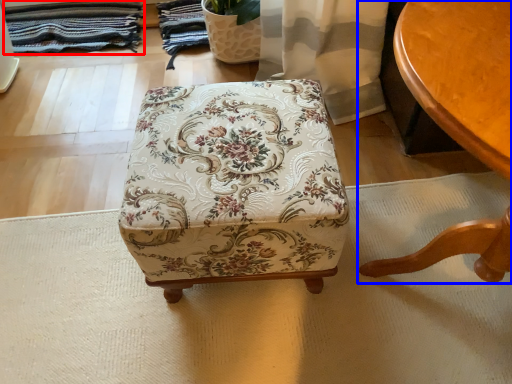
Question: Which of the following is the closest to the observer, blanket (highlighted by a red box) or table (highlighted by a blue box)?

Choices:
 (A) blanket
 (B) table

Answer: (B)